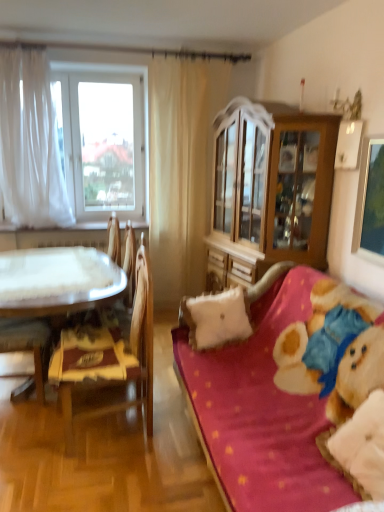
Find the location of a particular element. Image resolution: width=384 pixels, height=512 pixels. vacant area in front of wooden chair at left is located at coordinates (94, 480).